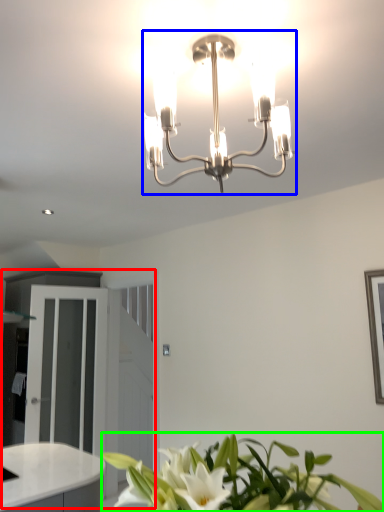
Question: Which object is positioned farthest from dresser (highlighted by a red box)? Select from lamp (highlighted by a blue box) and houseplant (highlighted by a green box).

Choices:
 (A) lamp
 (B) houseplant

Answer: (A)